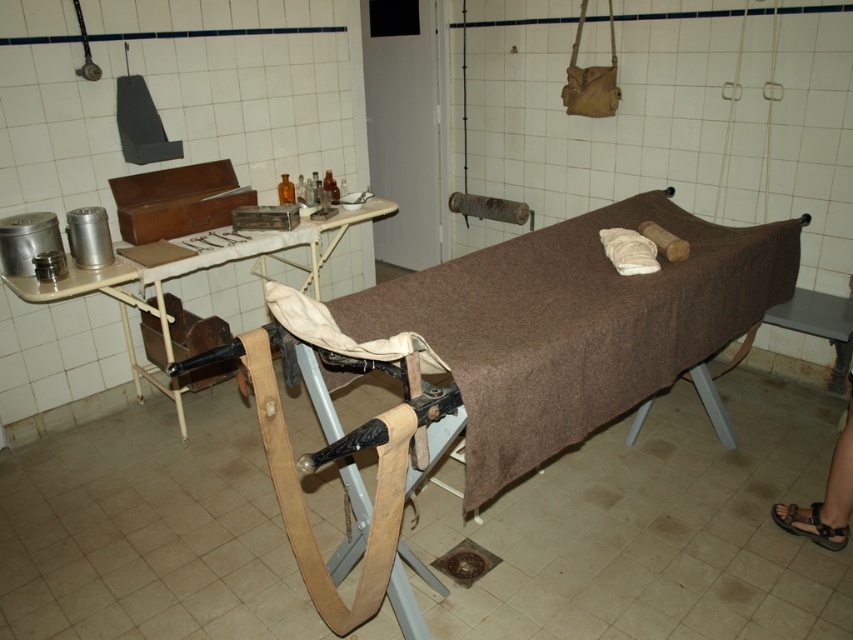
Question: Which point is farther to the camera?

Choices:
 (A) (318, 230)
 (B) (640, 204)

Answer: (A)

Question: Can you confirm if brown fabric bed at center is positioned to the right of metallic silver tray at upper left?

Choices:
 (A) no
 (B) yes

Answer: (B)

Question: Which object appears farthest from the camera in this image?

Choices:
 (A) brown fabric bed at center
 (B) metallic silver tray at upper left

Answer: (B)

Question: Is brown fabric bed at center positioned behind metallic silver tray at upper left?

Choices:
 (A) yes
 (B) no

Answer: (B)

Question: Is brown fabric bed at center further to camera compared to metallic silver tray at upper left?

Choices:
 (A) no
 (B) yes

Answer: (A)